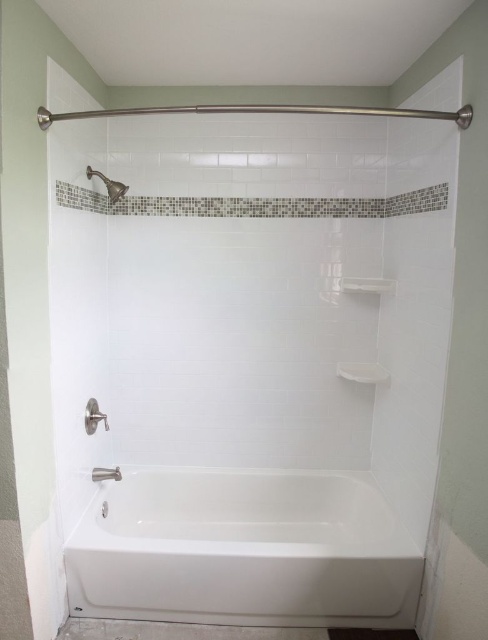
You are a bathroom designer planning to install a new towel rack. You see the white ceramic bathtub at lower center and the white glossy shelf at upper center. Which object is positioned to the left of the other?

The white ceramic bathtub at lower center is to the left of the white glossy shelf at upper center.

You are a plumber inspecting the bathroom layout. You need to ensure that the water from the brushed metal showerhead at upper left can reach the white ceramic bathtub at lower center. Is the showerhead positioned above the bathtub?

The white ceramic bathtub at lower center is located below the brushed metal showerhead at upper left, so yes, the showerhead is positioned above the bathtub.

You are a plumber checking the bathroom layout. You need to install a new showerhead that requires a minimum of 20 cm clearance above the bathtub. Given the current setup, can the brushed metal showerhead at upper left be safely installed above the white ceramic bathtub at lower center?

The white ceramic bathtub at lower center has a greater height compared to the brushed metal showerhead at upper left. This means the showerhead is positioned higher up, so there should be sufficient clearance above the bathtub. Since the showerhead is already at upper left and the bathtub is lower, the 20 cm clearance requirement is likely met. The installation should be safe.